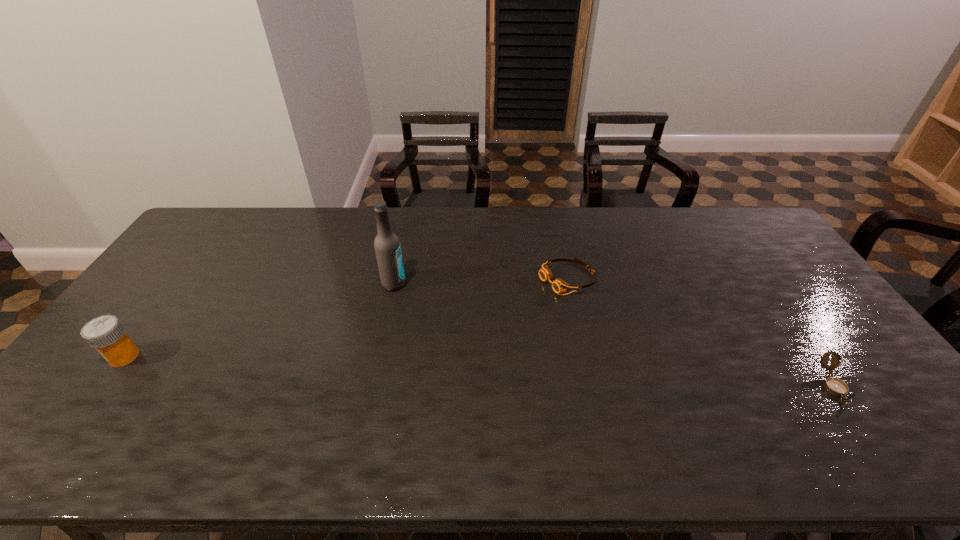
Find the location of a particular element. This screenshot has height=540, width=960. vacant region at the left edge is located at coordinates (142, 304).

Where is `free space at the right edge`? free space at the right edge is located at coordinates (756, 253).

Where is `free spot between the shortest object and the beer bottle`? free spot between the shortest object and the beer bottle is located at coordinates (480, 281).

This screenshot has width=960, height=540. What are the coordinates of `vacant space in between the third tallest object and the second object from right to left` in the screenshot? It's located at 700,332.

The width and height of the screenshot is (960, 540). I want to click on empty location between the beer bottle and the rightmost object, so click(613, 335).

This screenshot has width=960, height=540. I want to click on free space between the beer bottle and the leftmost object, so click(x=259, y=320).

This screenshot has width=960, height=540. Find the location of `unoccupied area between the tallest object and the goggles`. unoccupied area between the tallest object and the goggles is located at coordinates pyautogui.click(x=480, y=281).

The width and height of the screenshot is (960, 540). I want to click on free space between the tallest object and the rightmost object, so click(613, 335).

Image resolution: width=960 pixels, height=540 pixels. Identify the location of free space between the second object from left to right and the leftmost object. (259, 320).

Where is `unoccupied position between the tallest object and the compass`? Image resolution: width=960 pixels, height=540 pixels. unoccupied position between the tallest object and the compass is located at coordinates (613, 335).